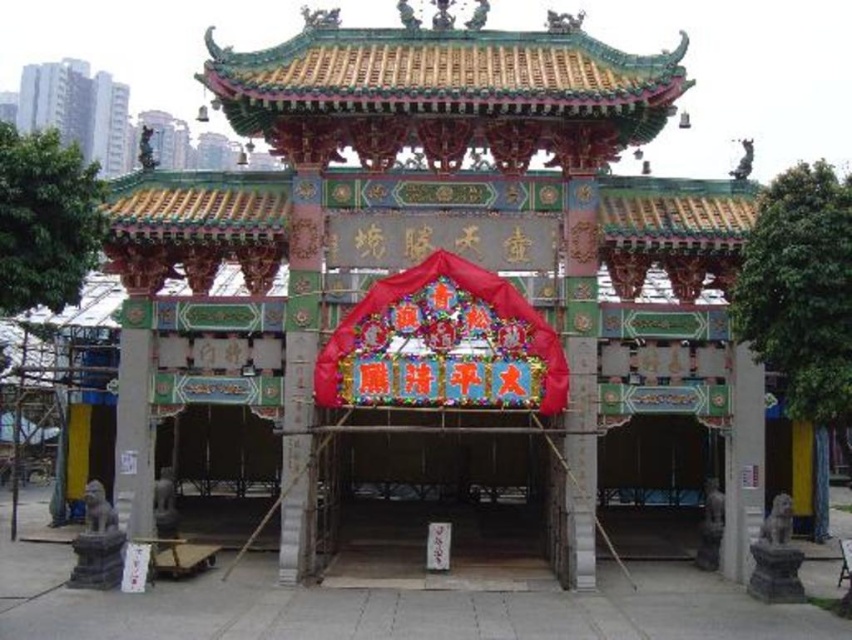
You are standing at the entrance of the traditional Chinese gate and want to take a photo of the multicolored painted wooden gazebo at center. Based on its coordinates, is the gazebo positioned more to the left or right side of the image?

The multicolored painted wooden gazebo at center is located at point [440,262], which places it near the center of the image. Since the x coordinate is 0.411, it is slightly to the left of the exact center, but still considered central overall.

You are standing at the entrance of the temple and want to locate the multicolored painted wooden gazebo at center. According to the coordinates provided, where exactly is it positioned?

The multicolored painted wooden gazebo at center is located at coordinates point (440, 262).

You are a visitor approaching the traditional Chinese gate. You notice the wooden gate at center and the shiny red fabric canopy at center. Which object is closer to you as you approach the entrance?

The wooden gate at center is closer to you because the shiny red fabric canopy at center is positioned behind it.